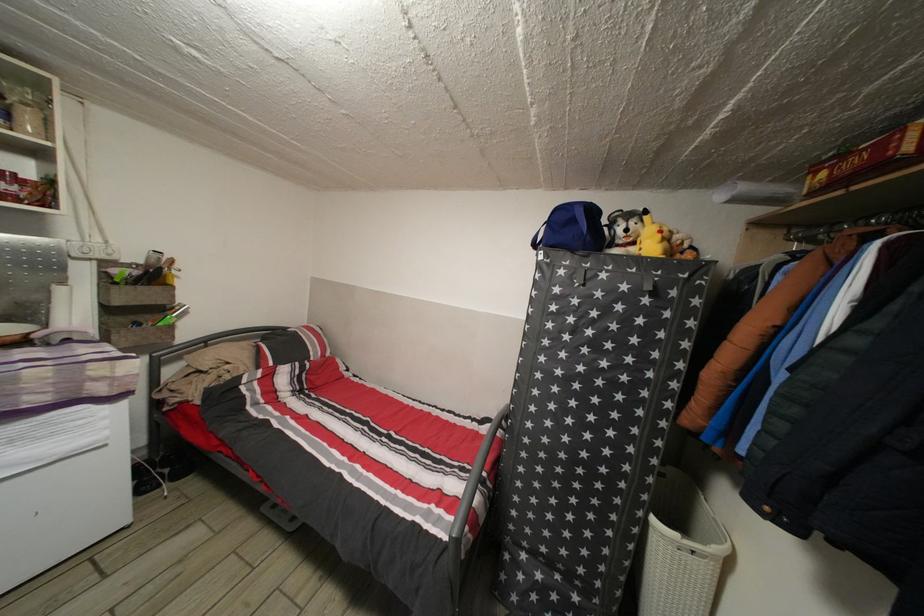
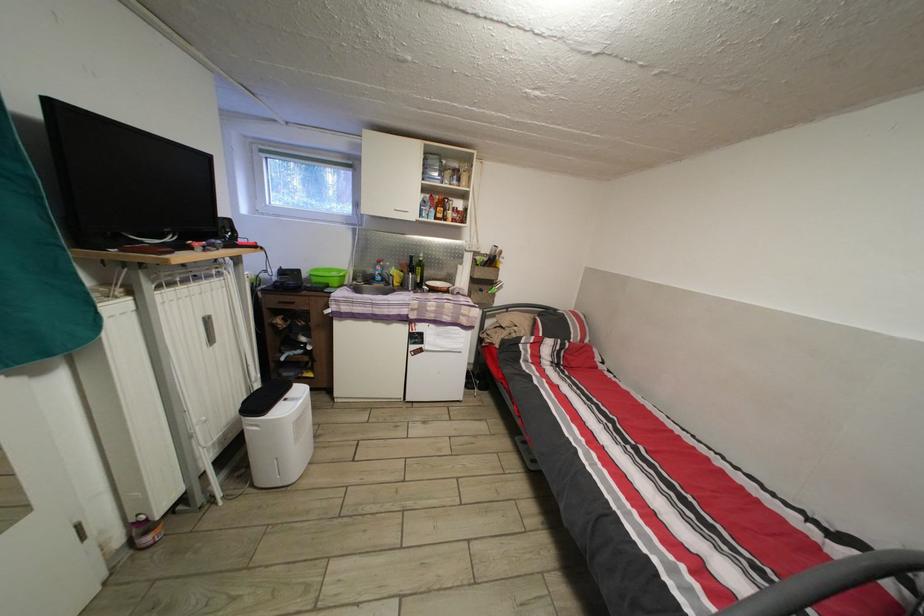
Question: The images are taken continuously from a first-person perspective. In which direction is your viewpoint rotating?

Choices:
 (A) Left
 (B) Right
 (C) Up
 (D) Down

Answer: (A)